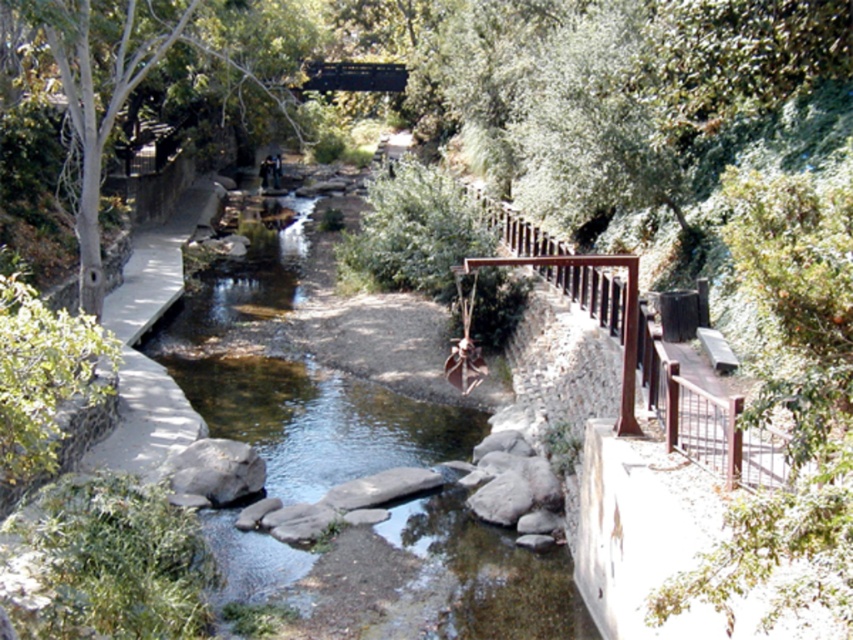
Is green leafy tree at left thinner than metallic bridge at upper center?

Yes.

Is green leafy tree at left wider than metallic bridge at upper center?

In fact, green leafy tree at left might be narrower than metallic bridge at upper center.

This screenshot has width=853, height=640. Find the location of `green leafy tree at left`. green leafy tree at left is located at coordinates (126, 81).

Image resolution: width=853 pixels, height=640 pixels. I want to click on green leafy tree at left, so click(126, 81).